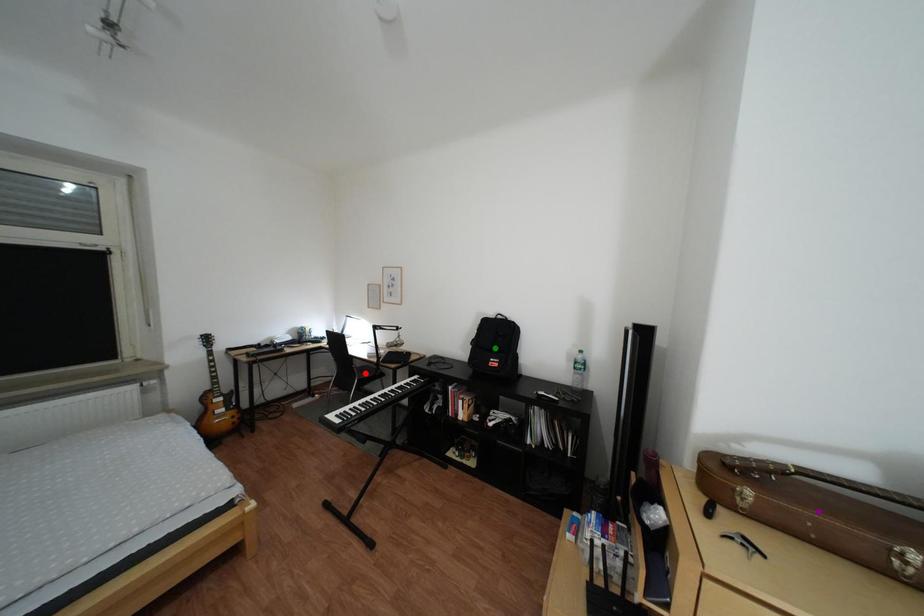
Order these from nearest to farthest:
- green point
- red point
- purple point

1. purple point
2. green point
3. red point